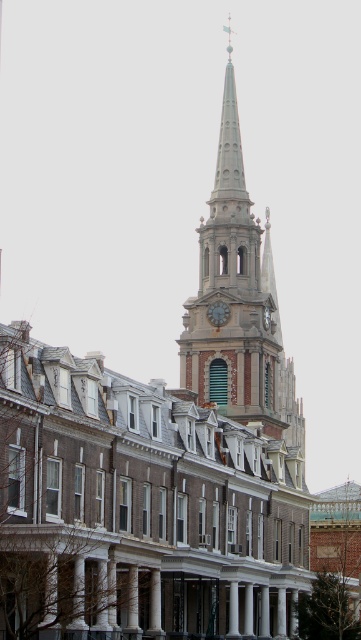
Question: Is smooth gray steeple at center positioned in front of green stone clock at center?

Choices:
 (A) no
 (B) yes

Answer: (B)

Question: Observing the image, what is the correct spatial positioning of smooth gray steeple at center in reference to green stone clock at center?

Choices:
 (A) left
 (B) right

Answer: (B)

Question: Which point is closer to the camera taking this photo?

Choices:
 (A) (222, 321)
 (B) (241, 252)

Answer: (A)

Question: Can you confirm if smooth gray steeple at center is positioned above green stone clock at center?

Choices:
 (A) yes
 (B) no

Answer: (A)